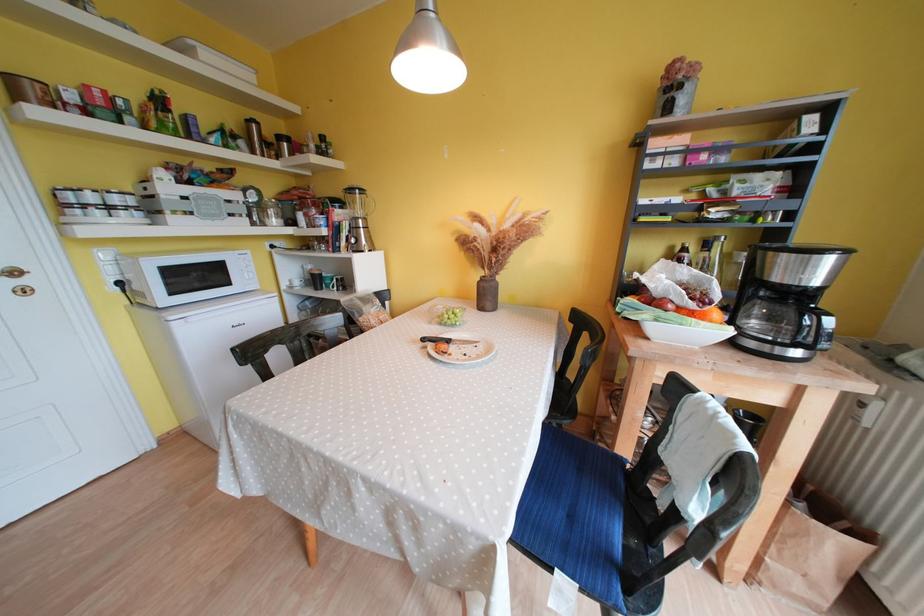
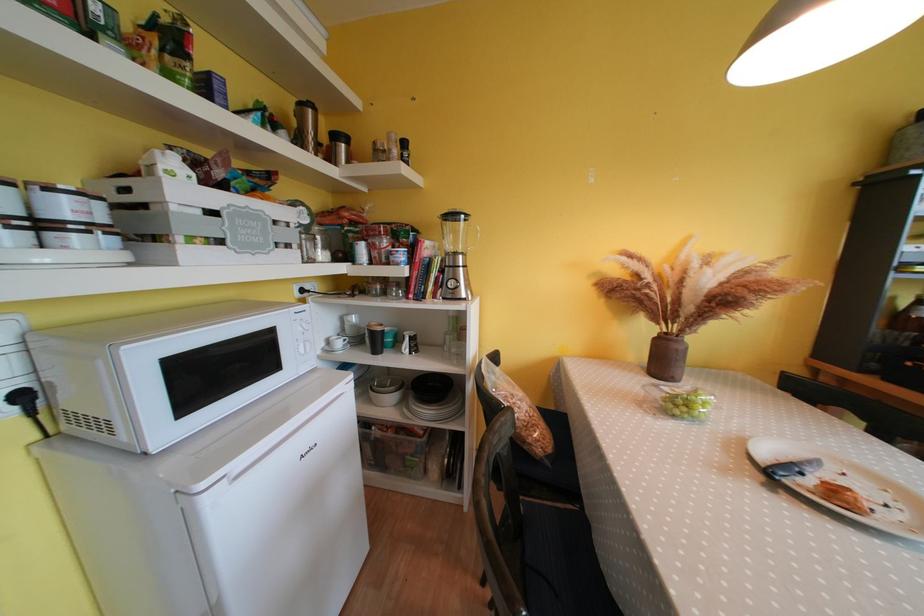
The point at (x=286, y=140) is marked in the first image. Where is the corresponding point in the second image?

(342, 140)